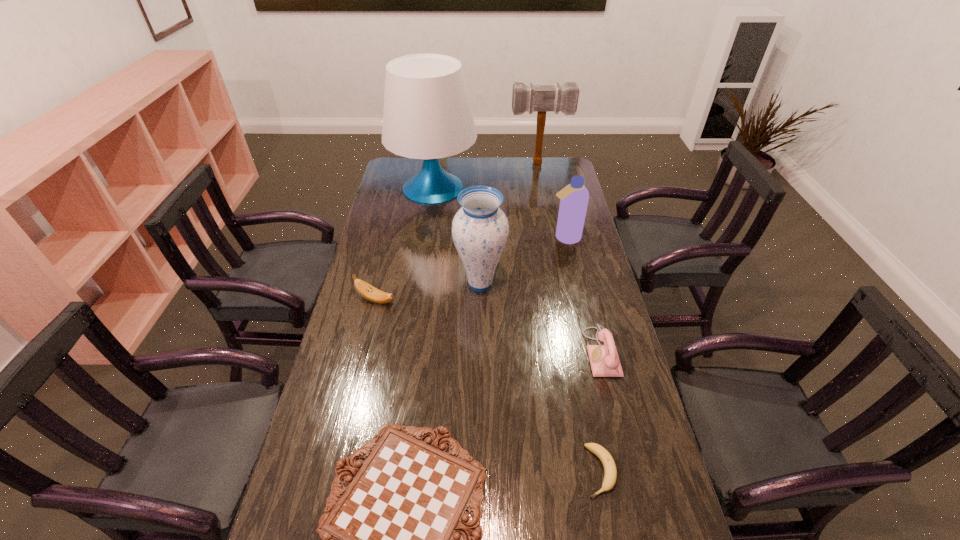
Where is `free region at the left edge of the desktop`? The width and height of the screenshot is (960, 540). free region at the left edge of the desktop is located at coordinates (376, 306).

The height and width of the screenshot is (540, 960). I want to click on vacant region at the far right corner of the desktop, so (x=551, y=173).

Image resolution: width=960 pixels, height=540 pixels. In order to click on vacant point located between the table lamp and the nearer banana in this screenshot , I will do (x=516, y=329).

Locate an element on the screen. free space between the telephone and the left banana is located at coordinates (489, 326).

Where is `free space between the sixth farthest object and the second shortest object`? This screenshot has width=960, height=540. free space between the sixth farthest object and the second shortest object is located at coordinates (601, 411).

In order to click on free space between the mallet and the fifth shortest object in this screenshot , I will do (552, 200).

You are a GUI agent. You are given a task and a screenshot of the screen. Output one action in this format:
    pyautogui.click(x=<x>, y=<y>)
    Task: Click on the object that stands as the sixth closest to the shorter banana
    The height and width of the screenshot is (540, 960).
    Given the screenshot: What is the action you would take?
    pyautogui.click(x=427, y=115)

Locate which object ranks in proximity to the left banana. Please provide its 2D coordinates. Your answer should be formatted as a tuple, i.e. [(x, y)], where the tuple contains the x and y coordinates of a point satisfying the conditions above.

[(480, 229)]